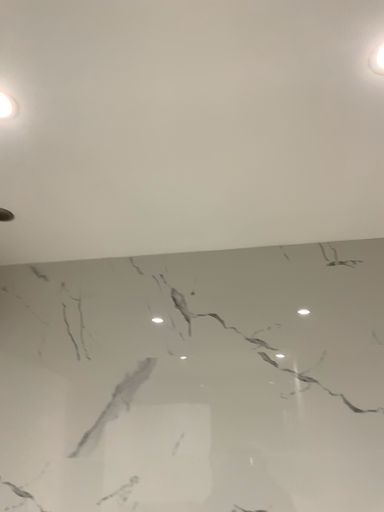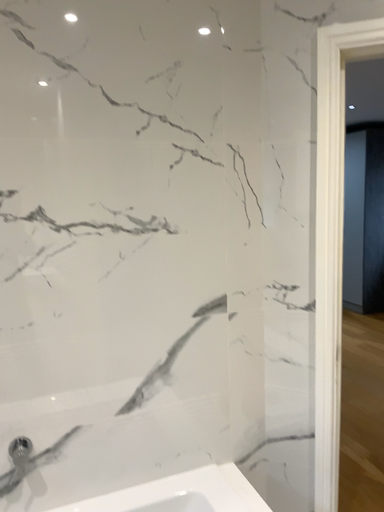
Question: Which way did the camera rotate in the video?

Choices:
 (A) rotated right
 (B) rotated left

Answer: (A)